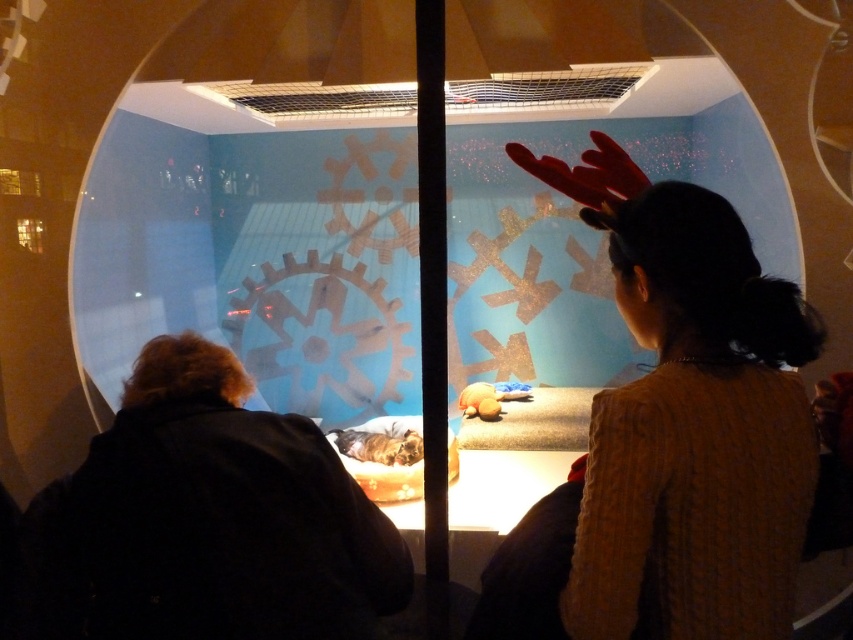
Consider the image. Does knitted sweater at upper right have a greater height compared to rubber glove at upper center?

Yes, knitted sweater at upper right is taller than rubber glove at upper center.

Can you confirm if knitted sweater at upper right is positioned to the left of rubber glove at upper center?

Incorrect, knitted sweater at upper right is not on the left side of rubber glove at upper center.

The image size is (853, 640). Find the location of `knitted sweater at upper right`. knitted sweater at upper right is located at coordinates (697, 432).